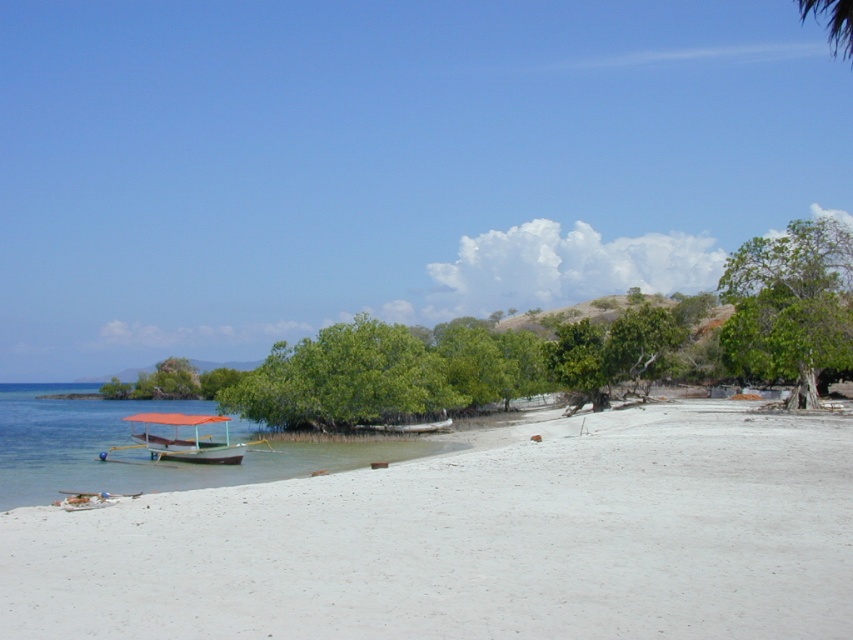
Is clear water at lower left further to the viewer compared to orange fabric boat at lower left?

No, it is in front of orange fabric boat at lower left.

Image resolution: width=853 pixels, height=640 pixels. Identify the location of clear water at lower left. (148, 461).

Locate an element on the screen. The height and width of the screenshot is (640, 853). clear water at lower left is located at coordinates (148, 461).

At what (x,y) coordinates should I click in order to perform the action: click on clear water at lower left. Please return your answer as a coordinate pair (x, y). The width and height of the screenshot is (853, 640). Looking at the image, I should click on (148, 461).

Is green leafy tree at right thinner than white matte boat at center?

No, green leafy tree at right is not thinner than white matte boat at center.

Does green leafy tree at right come in front of white matte boat at center?

Yes, it is in front of white matte boat at center.

Is point (849, 284) farther from camera compared to point (403, 433)?

That is False.

You are a GUI agent. You are given a task and a screenshot of the screen. Output one action in this format:
    pyautogui.click(x=<x>, y=<y>)
    Task: Click on the green leafy tree at right
    
    Given the screenshot: What is the action you would take?
    pyautogui.click(x=790, y=305)

Who is positioned more to the right, orange fabric boat at lower left or green leafy tree at center?

orange fabric boat at lower left is more to the right.

Locate an element on the screen. orange fabric boat at lower left is located at coordinates (180, 440).

Locate an element on the screen. orange fabric boat at lower left is located at coordinates (180, 440).